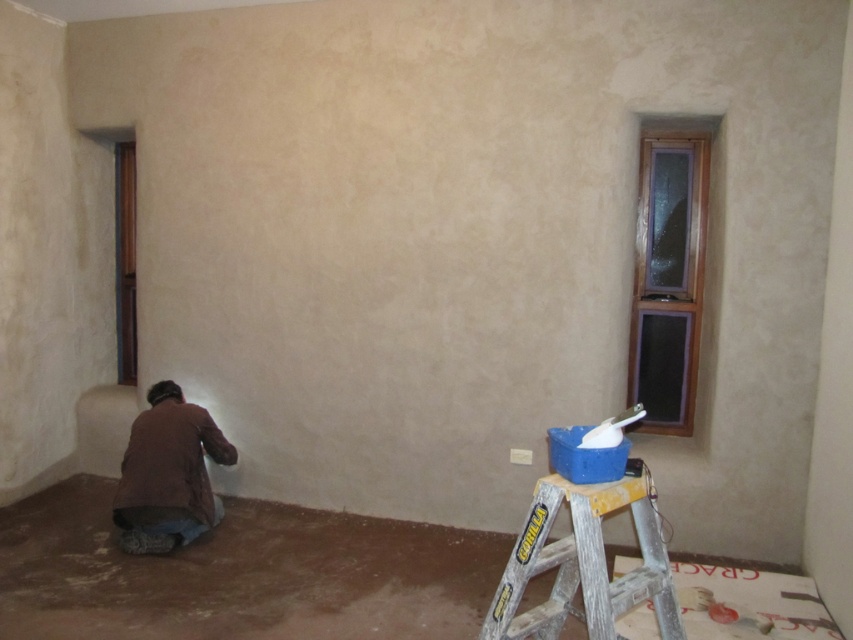
You are a painter trying to reach the window on the right. You have a silver aluminum ladder at lower right and a brown fabric at lower left. Which object should you use to access the window?

The silver aluminum ladder at lower right is the appropriate tool to reach the window, as it is designed for climbing and accessing heights. The brown fabric at lower left likely cannot support your weight and is not suitable for this task.

You are a painter standing in the room. You need to reach the upper pane of the window to clean it. The silver aluminum ladder at lower right and the brown fabric at lower left are in your way. Which object should you move first to access the window?

The silver aluminum ladder at lower right is positioned on the right side of brown fabric at lower left. To access the window, you should move the brown fabric at lower left first because it is closer to the window and blocking the path.

You are a painter holding a 1.2 meter wide painting roller. You need to move from the brown fabric at lower left to the silver aluminum ladder at lower right to reach your tools. Is there enough space to move sideways between them?

The silver aluminum ladder at lower right might be wider than brown fabric at lower left, so there might not be enough space for the painter to move sideways with a 1.2 meter wide painting roller between them.